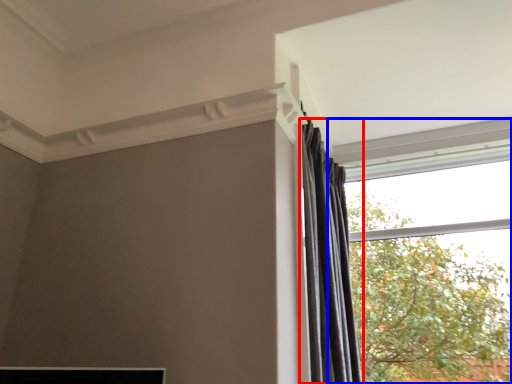
Question: Among these objects, which one is nearest to the camera, curtain (highlighted by a red box) or window (highlighted by a blue box)?

Choices:
 (A) curtain
 (B) window

Answer: (A)